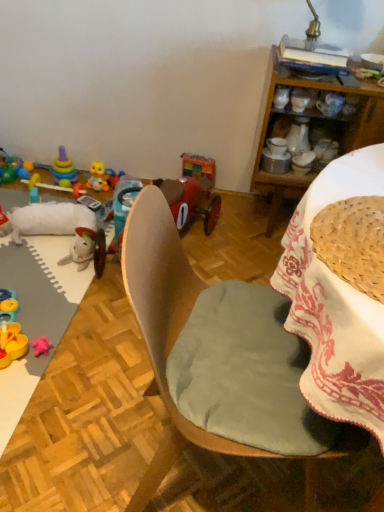
At what (x,y) coordinates should I click in order to perform the action: click on empty space that is to the right of rubber duck at lower left, the 3th toy from the left. Please return your answer as a coordinate pair (x, y). The height and width of the screenshot is (512, 384). Looking at the image, I should click on (46, 355).